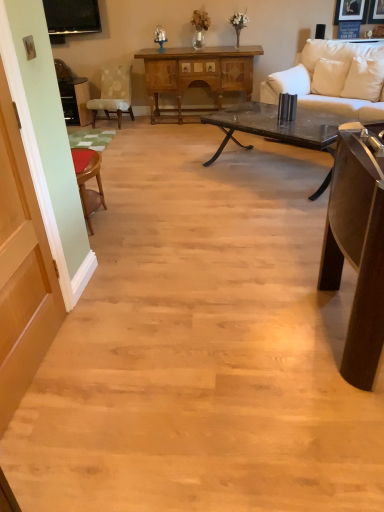
This screenshot has height=512, width=384. Find the location of `vacant space that is to the left of dark brown wood table at right, the 1th table when ordered from right to left`. vacant space that is to the left of dark brown wood table at right, the 1th table when ordered from right to left is located at coordinates (196, 342).